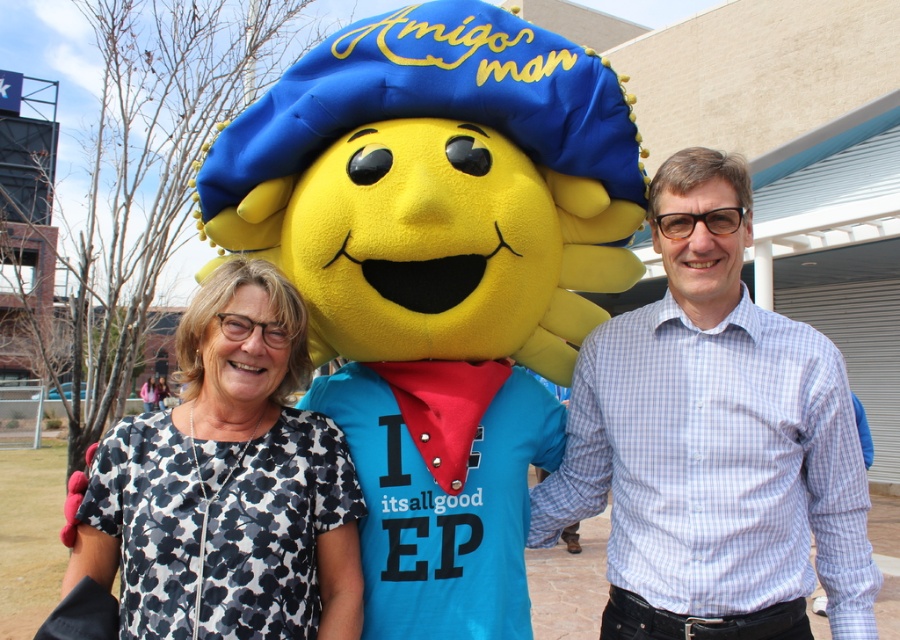
Which is in front, point (502, 604) or point (742, 314)?

Point (502, 604)

Based on the photo, between matte yellow head at center and white checkered shirt at center, which one appears on the left side from the viewer's perspective?

matte yellow head at center

Which is in front, point (245, 243) or point (871, 618)?

Point (871, 618)

Image resolution: width=900 pixels, height=640 pixels. What are the coordinates of `matte yellow head at center` in the screenshot? It's located at (439, 276).

Who is positioned more to the left, matte yellow head at center or white dotted shirt at center?

Positioned to the left is white dotted shirt at center.

Who is more distant from viewer, (365, 477) or (101, 449)?

Point (365, 477)

Between point (441, 621) and point (165, 614), which one is positioned in front?

Positioned in front is point (165, 614).

The image size is (900, 640). What are the coordinates of `matte yellow head at center` in the screenshot? It's located at (439, 276).

Based on the photo, is the position of white checkered shirt at center more distant than that of white dotted shirt at center?

Yes, white checkered shirt at center is behind white dotted shirt at center.

Measure the distance from white checkered shirt at center to white dotted shirt at center.

A: The distance of white checkered shirt at center from white dotted shirt at center is 1.06 meters.

Is point (702, 381) positioned in front of point (212, 602)?

No, (702, 381) is further to viewer.

This screenshot has height=640, width=900. Find the location of `white checkered shirt at center`. white checkered shirt at center is located at coordinates (713, 442).